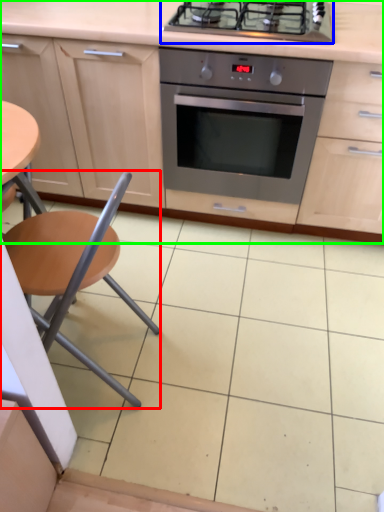
Question: Based on their relative distances, which object is nearer to chair (highlighted by a red box)? Choose from gas stove (highlighted by a blue box) and cabinetry (highlighted by a green box).

Choices:
 (A) gas stove
 (B) cabinetry

Answer: (B)